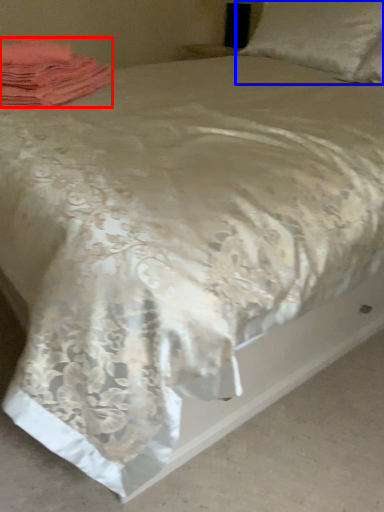
Question: Which object is further to the camera taking this photo, material (highlighted by a red box) or pillow (highlighted by a blue box)?

Choices:
 (A) material
 (B) pillow

Answer: (B)